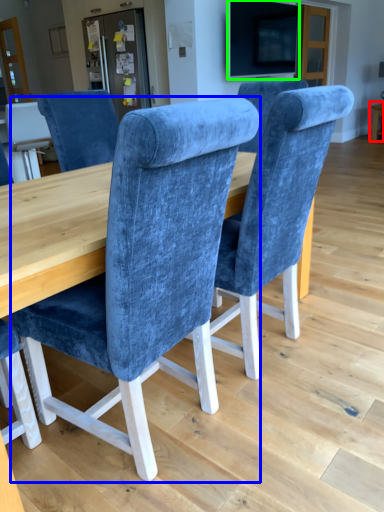
Question: Which object is the farthest from table (highlighted by a red box)? Choose among these: chair (highlighted by a blue box) or television (highlighted by a green box).

Choices:
 (A) chair
 (B) television

Answer: (A)